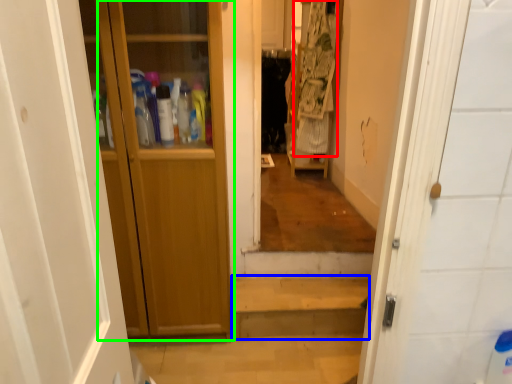
Question: Considering the real-world distances, which object is farthest from laundry (highlighted by a red box)? stairwell (highlighted by a blue box) or door (highlighted by a green box)?

Choices:
 (A) stairwell
 (B) door

Answer: (B)